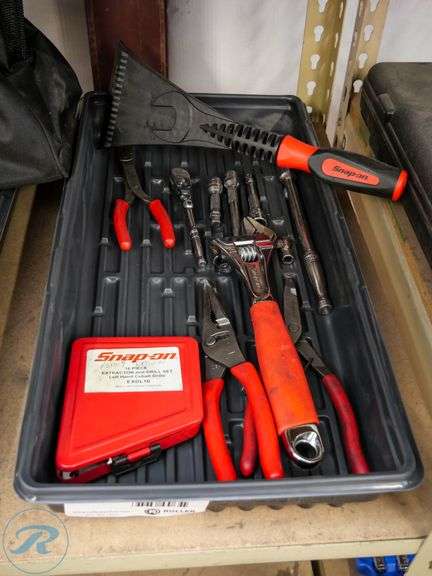
You are a GUI agent. You are given a task and a screenshot of the screen. Output one action in this format:
    pyautogui.click(x=<x>, y=<y>)
    Task: Click on the blue tool on shelf under red tools
    The width and height of the screenshot is (432, 576).
    Given the screenshot: What is the action you would take?
    pyautogui.click(x=371, y=566)